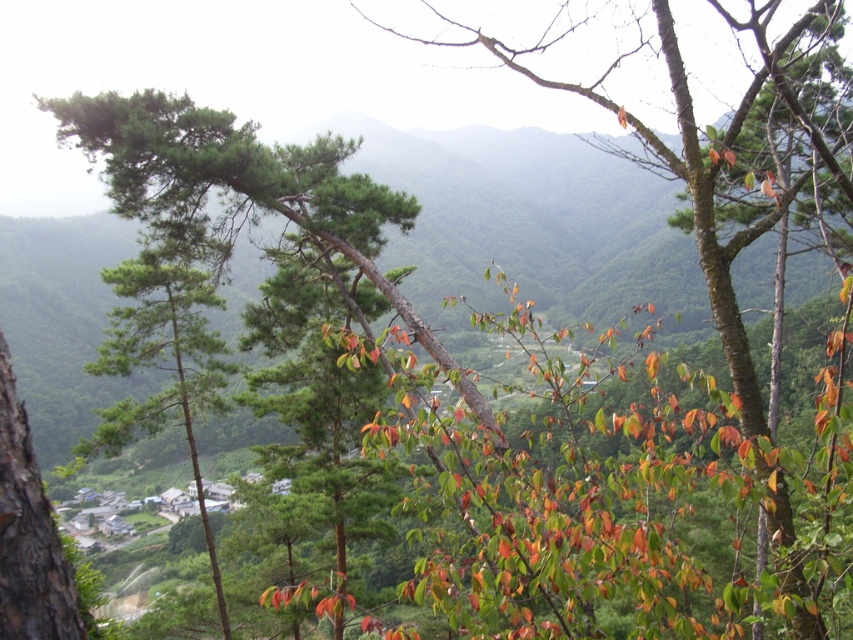
Looking at this image, who is more forward, (670, 435) or (183, 269)?

Point (183, 269)

Is green matte tree at upper center closer to camera compared to green matte tree at left?

Yes, it is in front of green matte tree at left.

Measure the distance between green matte tree at upper center and camera.

A distance of 13.64 feet exists between green matte tree at upper center and camera.

At what (x,y) coordinates should I click in order to perform the action: click on green matte tree at upper center. Please return your answer as a coordinate pair (x, y). Looking at the image, I should click on (664, 400).